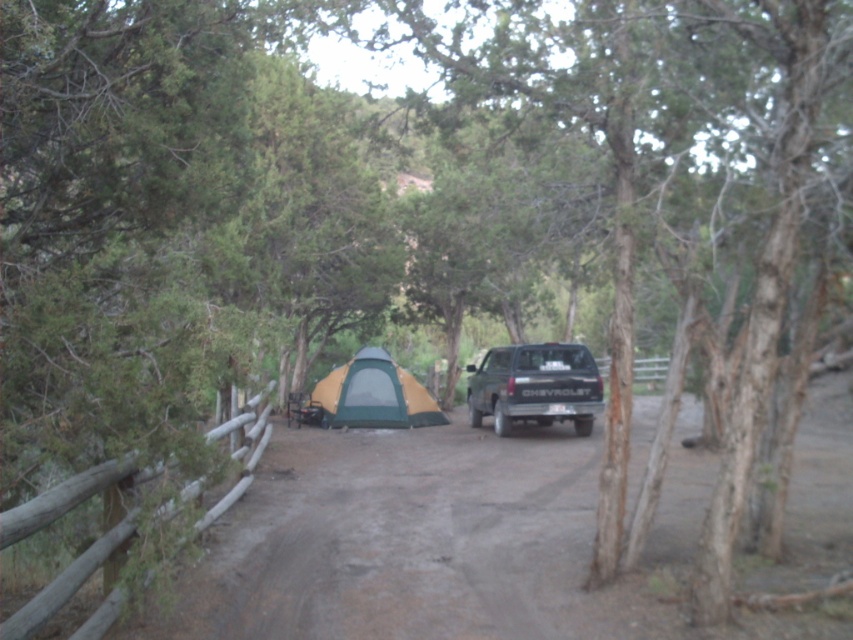
You are planning to drive a matte black truck at center through a narrow path between the wooden fence at left and the trees on the right. Based on the scene description, will the truck fit through the path?

The matte black truck at center is wider than the wooden fence at left, but the fence is part of the path boundary. Since the truck is wider than the fence, it might not fit through the narrow path between the wooden fence at left and the trees on the right.

You are standing at the starting point of the dirt path and want to reach the matte black truck at center. Which direction should you walk to get there?

Walk straight along the dirt path towards the center of the image to reach the matte black truck at center.